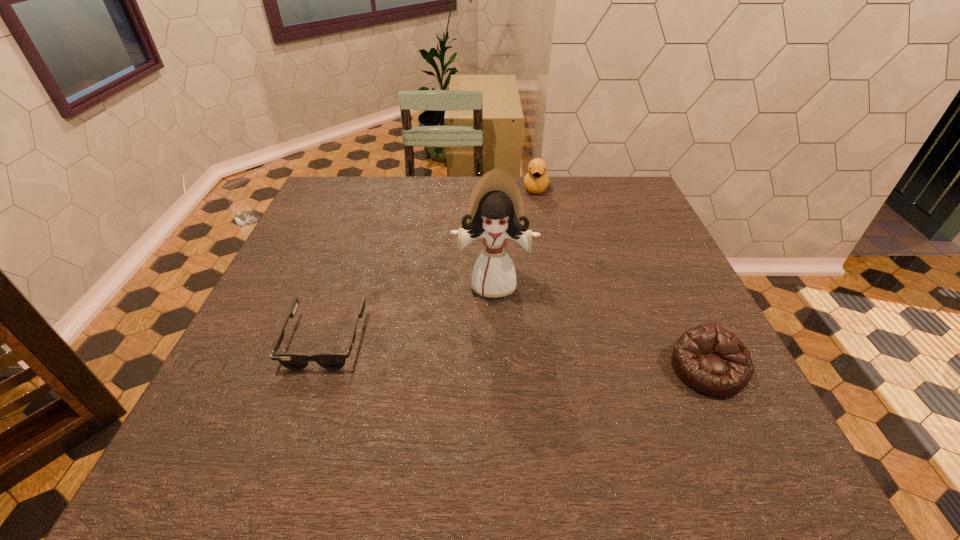
What are the coordinates of `object that is at the near right corner` in the screenshot? It's located at (710, 359).

Where is `vacant space at the far edge`? This screenshot has width=960, height=540. vacant space at the far edge is located at coordinates click(x=371, y=213).

Find the location of a particular element. vacant region at the near edge of the desktop is located at coordinates (410, 381).

In the image, there is a desktop. Find the location of `blank space at the left edge`. blank space at the left edge is located at coordinates (264, 304).

You are a GUI agent. You are given a task and a screenshot of the screen. Output one action in this format:
    pyautogui.click(x=<x>, y=<y>)
    Task: Click on the vacant region at the right edge of the desktop
    This screenshot has width=960, height=540.
    Given the screenshot: What is the action you would take?
    pyautogui.click(x=642, y=243)

In the image, there is a desktop. Identify the location of free region at the far left corner. This screenshot has width=960, height=540. (365, 181).

Identify the location of free space between the second tallest object and the second shortest object. (622, 279).

Locate an element on the screen. free spot between the rightmost object and the third object from right to left is located at coordinates (601, 326).

The width and height of the screenshot is (960, 540). Identify the location of vacant area between the third tallest object and the second farthest object. (601, 326).

This screenshot has width=960, height=540. I want to click on free space between the leftmost object and the second object from right to left, so click(430, 264).